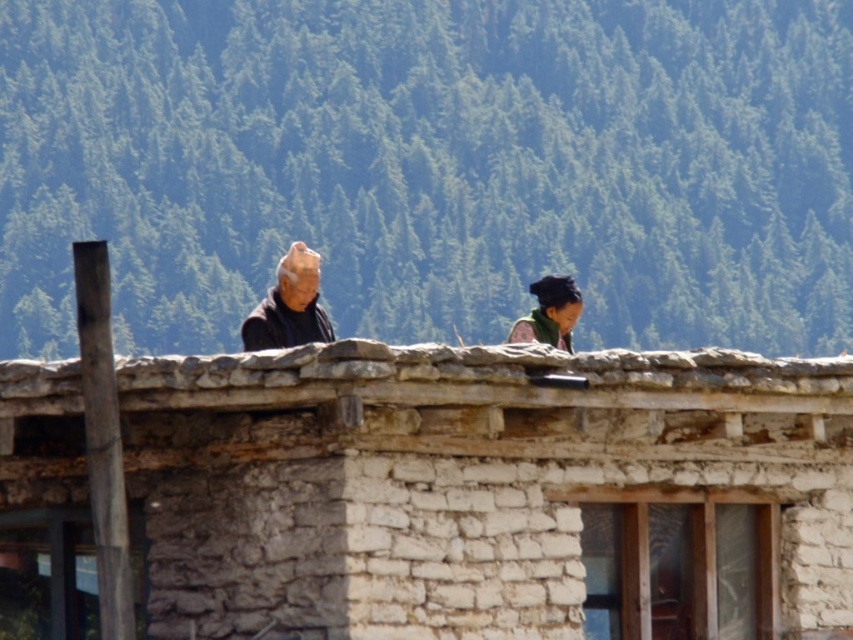
What are the coordinates of `green textured hillside at upper center` in the screenshot? It's located at (431, 166).

Which is more to the right, green textured hillside at upper center or dark green fabric headscarf at upper right?

dark green fabric headscarf at upper right is more to the right.

Measure the distance between point (509,220) and camera.

The distance of point (509,220) from camera is 162.90 meters.

At what (x,y) coordinates should I click in order to perform the action: click on green textured hillside at upper center. Please return your answer as a coordinate pair (x, y). This screenshot has height=640, width=853. Looking at the image, I should click on (431, 166).

Looking at this image, how distant is dark brown fabric at center from dark green fabric headscarf at upper right?

dark brown fabric at center and dark green fabric headscarf at upper right are 9.80 meters apart.

Can you confirm if dark brown fabric at center is wider than dark green fabric headscarf at upper right?

Yes.

Who is more distant from viewer, (305, 300) or (556, 340)?

The point (556, 340) is more distant.

Identify the location of dark brown fabric at center. This screenshot has height=640, width=853. (289, 305).

Is point (167, 582) less distant than point (543, 280)?

Yes, point (167, 582) is in front of point (543, 280).

Which of these two, stone wall at center or dark green fabric headscarf at upper right, stands shorter?

With less height is dark green fabric headscarf at upper right.

At what (x,y) coordinates should I click in order to perform the action: click on stone wall at center. Please return your answer as a coordinate pair (x, y). This screenshot has height=640, width=853. Looking at the image, I should click on (485, 488).